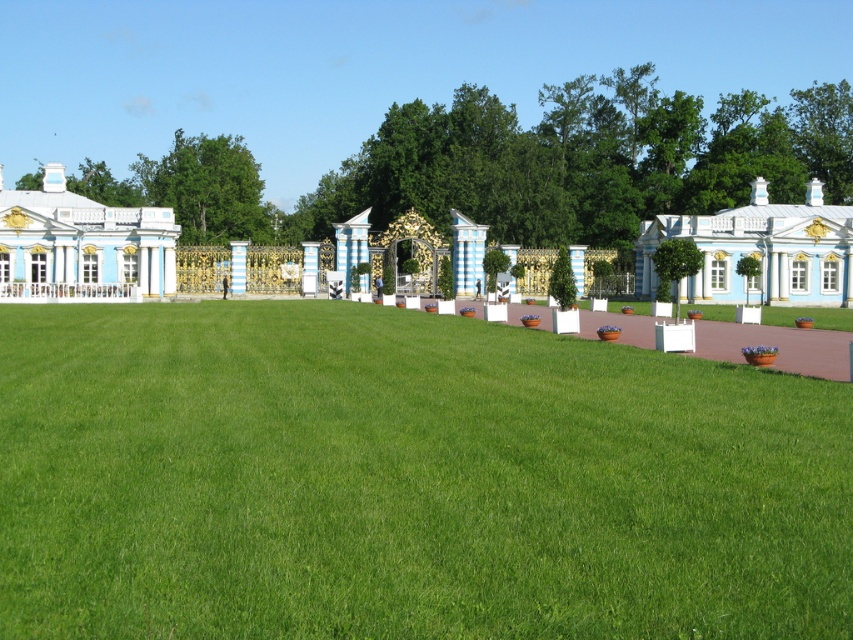
Question: From the image, what is the correct spatial relationship of green grass at lower center in relation to white glossy palace at left?

Choices:
 (A) below
 (B) above

Answer: (A)

Question: Considering the relative positions of green grass at lower center and blue painted wood palace at right in the image provided, where is green grass at lower center located with respect to blue painted wood palace at right?

Choices:
 (A) above
 (B) below

Answer: (B)

Question: Estimate the real-world distances between objects in this image. Which object is farther from the blue painted wood palace at right?

Choices:
 (A) white glossy palace at left
 (B) green grass at lower center

Answer: (A)

Question: Which point is farther to the camera?

Choices:
 (A) blue painted wood palace at right
 (B) green grass at lower center
 (C) white glossy palace at left

Answer: (C)

Question: Which of the following is the closest to the observer?

Choices:
 (A) (32, 275)
 (B) (439, 566)
 (C) (792, 284)

Answer: (B)

Question: Can you confirm if green grass at lower center is positioned to the right of blue painted wood palace at right?

Choices:
 (A) yes
 (B) no

Answer: (B)